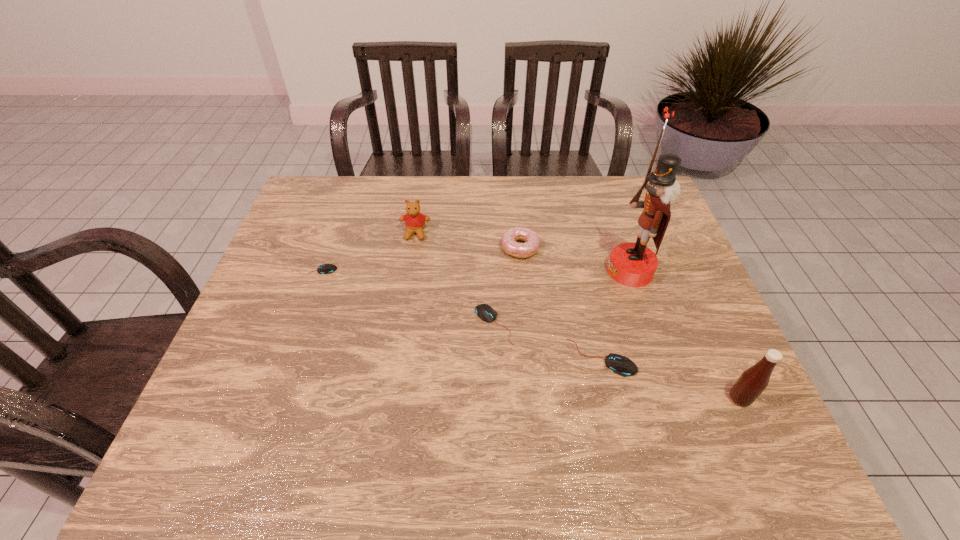
This screenshot has width=960, height=540. I want to click on Tabasco sauce, so click(x=753, y=381).

This screenshot has height=540, width=960. In order to click on free space located 0.380m on the back of the farthest mouse in this screenshot , I will do `click(345, 187)`.

Where is `free space located on the right of the second shortest object`? free space located on the right of the second shortest object is located at coordinates (660, 325).

Find the location of a particular element. Image resolution: width=960 pixels, height=540 pixels. free region located 0.170m on the right of the rightmost mouse is located at coordinates (707, 357).

This screenshot has width=960, height=540. I want to click on blank space located 0.220m on the front-facing side of the nutcracker, so click(528, 271).

Find the location of `vacant area located on the front-facing side of the nutcracker`. vacant area located on the front-facing side of the nutcracker is located at coordinates (524, 271).

You are a GUI agent. You are given a task and a screenshot of the screen. Output one action in this format:
    pyautogui.click(x=<x>, y=<y>)
    Task: Click on the free space located on the front-facing side of the nutcracker
    
    Given the screenshot: What is the action you would take?
    pyautogui.click(x=571, y=271)

Identify the location of vacant area located 0.280m on the right of the doughnut. The width and height of the screenshot is (960, 540). (636, 248).

The height and width of the screenshot is (540, 960). In order to click on vacant position located 0.070m on the front-facing side of the sixth object from right to left in this screenshot , I will do `click(412, 258)`.

Identify the location of vacant region located 0.370m on the left of the second tallest object. Image resolution: width=960 pixels, height=540 pixels. (557, 399).